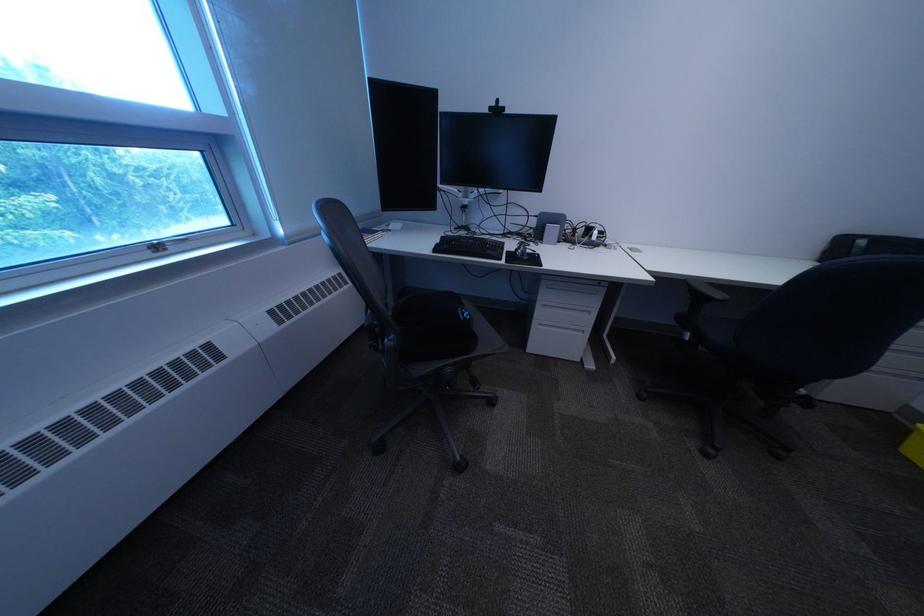
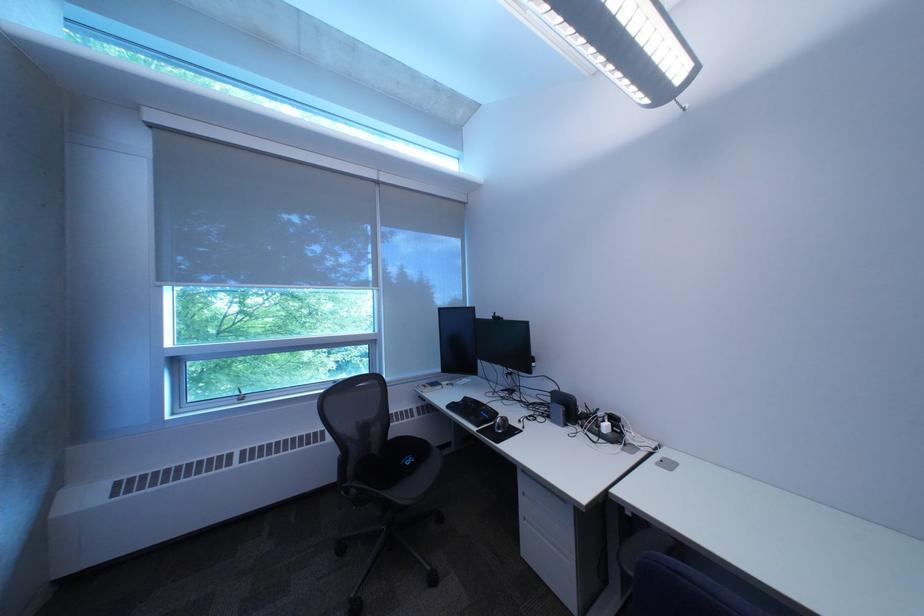
The point at (451, 252) is marked in the first image. Where is the corresponding point in the second image?

(464, 408)